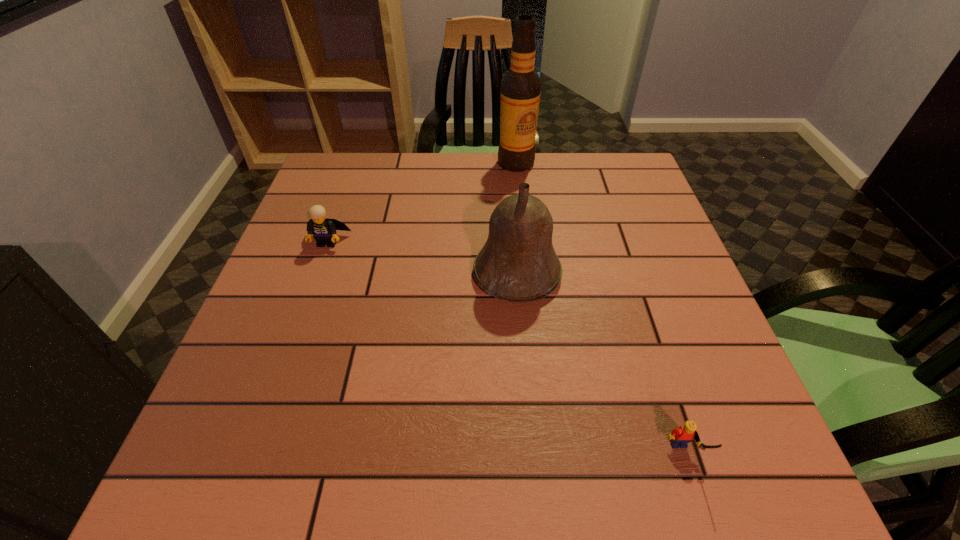
The height and width of the screenshot is (540, 960). Find the location of `free space that is in between the tallest object and the nearer Lego`. free space that is in between the tallest object and the nearer Lego is located at coordinates (599, 309).

This screenshot has height=540, width=960. In order to click on vacant area that lies between the nearest object and the second tallest object in this screenshot , I will do `click(600, 364)`.

Where is `free space between the rightmost object and the leftmost object`? The height and width of the screenshot is (540, 960). free space between the rightmost object and the leftmost object is located at coordinates (505, 348).

The image size is (960, 540). Find the location of `free space between the bell and the nearest object`. free space between the bell and the nearest object is located at coordinates (600, 364).

You are a GUI agent. You are given a task and a screenshot of the screen. Output one action in this format:
    pyautogui.click(x=<x>, y=<y>)
    Task: Click on the free space between the left Lego and the alcohol
    The height and width of the screenshot is (540, 960).
    Given the screenshot: What is the action you would take?
    pyautogui.click(x=421, y=202)

Identify the location of free space between the leftmost object and the bell. This screenshot has width=960, height=540. (422, 258).

Image resolution: width=960 pixels, height=540 pixels. Identify the location of free space between the rightmost object and the left Lego. (505, 348).

This screenshot has height=540, width=960. Identify the location of free space between the nearest object and the second tallest object. (600, 364).

Find the location of `object that is the nearest to the bell`. object that is the nearest to the bell is located at coordinates (323, 230).

The width and height of the screenshot is (960, 540). Identify the location of object identified as the third closest to the second tallest object. (521, 85).